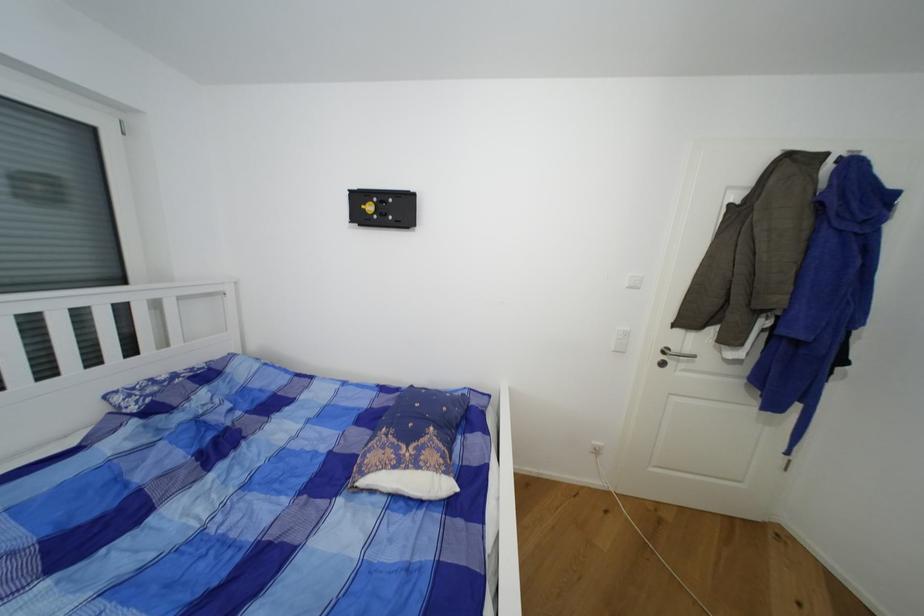
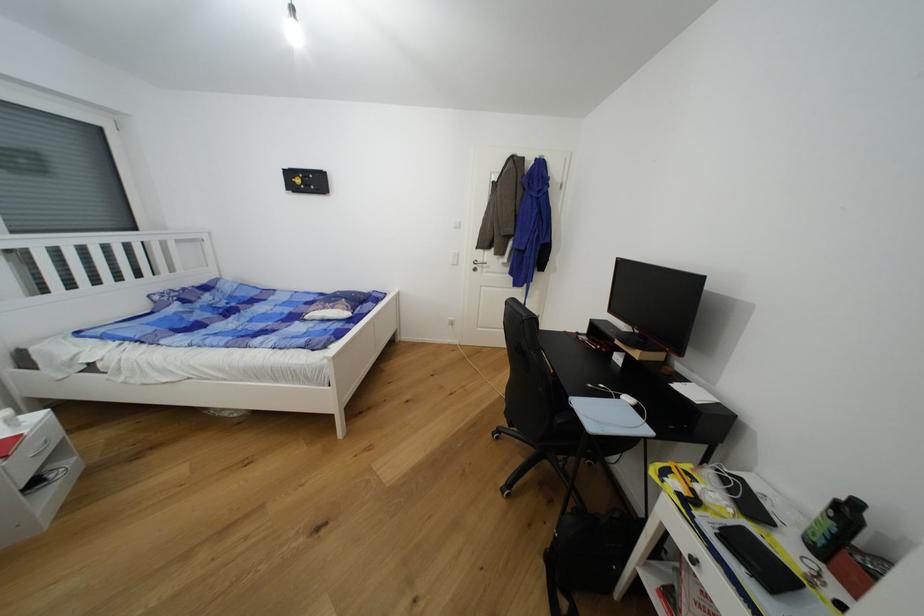
In the second image, find the point that corresponds to (x=123, y=400) in the first image.

(162, 299)